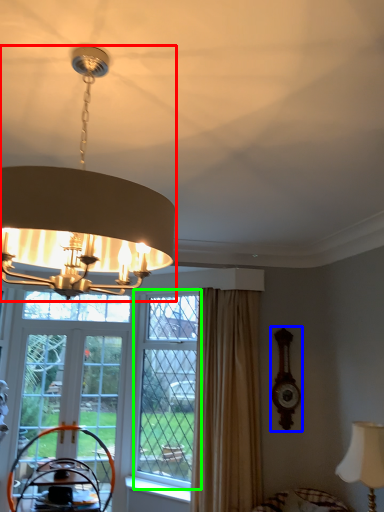
Question: Which is farther away from lamp (highlighted by a red box)? clock (highlighted by a blue box) or window (highlighted by a green box)?

Choices:
 (A) clock
 (B) window

Answer: (A)